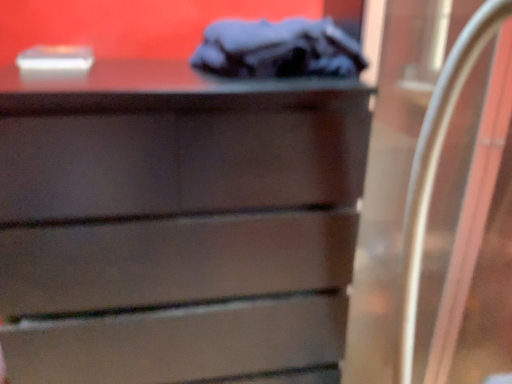
Question: Can you confirm if matte brown chest of drawers at center is thinner than clear glass door at right?

Choices:
 (A) no
 (B) yes

Answer: (A)

Question: Is matte brown chest of drawers at center wider than clear glass door at right?

Choices:
 (A) no
 (B) yes

Answer: (B)

Question: Is matte brown chest of drawers at center at the right side of clear glass door at right?

Choices:
 (A) yes
 (B) no

Answer: (B)

Question: From a real-world perspective, is matte brown chest of drawers at center located beneath clear glass door at right?

Choices:
 (A) no
 (B) yes

Answer: (B)

Question: Is matte brown chest of drawers at center aimed at clear glass door at right?

Choices:
 (A) yes
 (B) no

Answer: (B)

Question: Based on their positions, is dark gray fabric at upper center located to the left or right of matte brown chest of drawers at center?

Choices:
 (A) right
 (B) left

Answer: (A)

Question: In terms of size, does dark gray fabric at upper center appear bigger or smaller than matte brown chest of drawers at center?

Choices:
 (A) big
 (B) small

Answer: (B)

Question: Is dark gray fabric at upper center inside or outside of matte brown chest of drawers at center?

Choices:
 (A) inside
 (B) outside

Answer: (B)

Question: From a real-world perspective, is dark gray fabric at upper center positioned above or below matte brown chest of drawers at center?

Choices:
 (A) below
 (B) above

Answer: (B)

Question: Considering their positions, is clear glass door at right located in front of or behind matte brown chest of drawers at center?

Choices:
 (A) front
 (B) behind

Answer: (A)

Question: Choose the correct answer: Is clear glass door at right inside matte brown chest of drawers at center or outside it?

Choices:
 (A) outside
 (B) inside

Answer: (A)

Question: Based on their positions, is clear glass door at right located to the left or right of matte brown chest of drawers at center?

Choices:
 (A) left
 (B) right

Answer: (B)

Question: Looking at the image, does clear glass door at right seem bigger or smaller compared to matte brown chest of drawers at center?

Choices:
 (A) small
 (B) big

Answer: (A)

Question: Relative to clear glass door at right, is dark gray fabric at upper center in front or behind?

Choices:
 (A) front
 (B) behind

Answer: (B)

Question: Based on their positions, is dark gray fabric at upper center located to the left or right of clear glass door at right?

Choices:
 (A) left
 (B) right

Answer: (A)